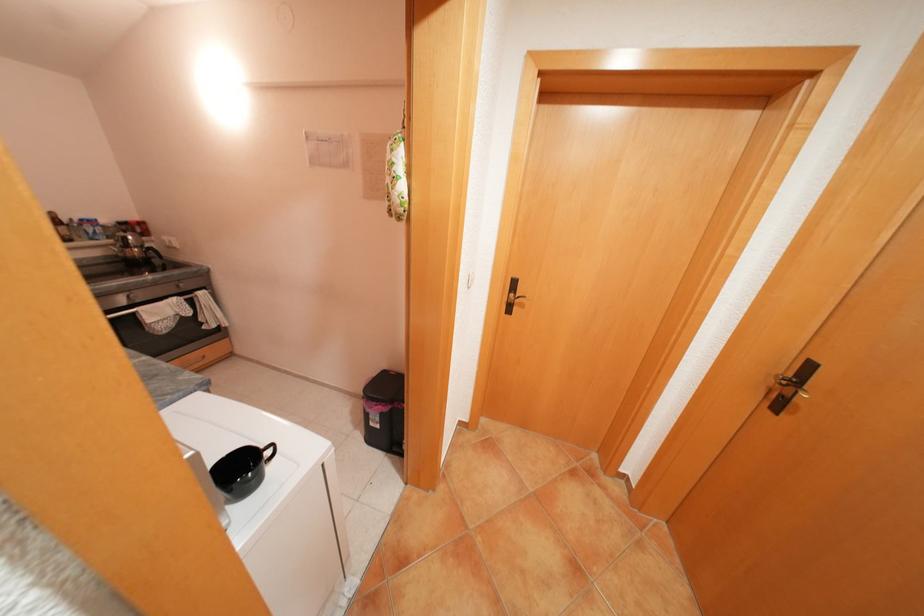
Where is `metal kettle handle`? Image resolution: width=924 pixels, height=616 pixels. metal kettle handle is located at coordinates (152, 254).